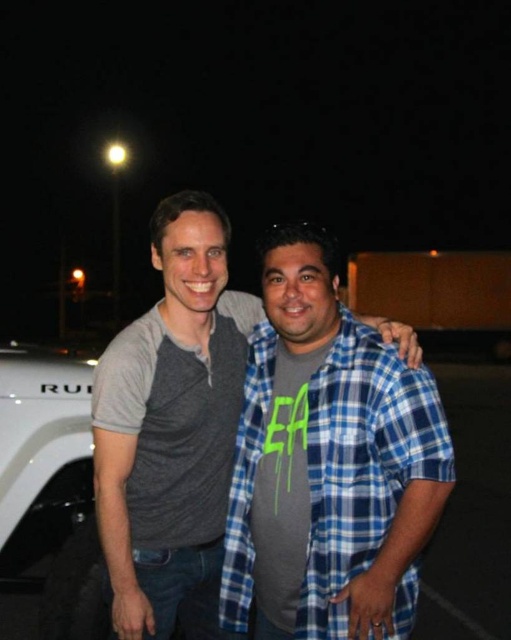
You are a photographer trying to capture a clear photo of the gray cotton shirt at center. The camera you are using has a minimum focusing distance of 5 feet. Can you take the photo without moving closer?

The gray cotton shirt at center is 7.09 feet away from the camera, which is beyond the minimum focusing distance of 5 feet. Therefore, you can take the photo without moving closer.

You are a photographer trying to capture a clear shot of both the blue plaid shirt at center and the brown matte pickup truck at center. Which object should you focus on first to ensure both are in focus?

You should focus on the blue plaid shirt at center first since it is closer to the viewer than the brown matte pickup truck at center. By focusing on the closer object, the truck will be within the depth of field and still appear sharp.

What are the coordinates of the blue plaid shirt at center?

The blue plaid shirt at center is located at coordinates point (361, 464).